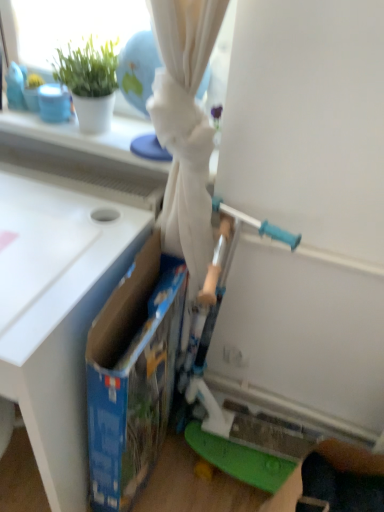
Question: Is white matte table at left to the left or to the right of blue cardboard box at center in the image?

Choices:
 (A) left
 (B) right

Answer: (A)

Question: Considering the positions of white matte table at left and blue cardboard box at center in the image, is white matte table at left wider or thinner than blue cardboard box at center?

Choices:
 (A) thin
 (B) wide

Answer: (B)

Question: Would you say white matte table at left is inside or outside blue cardboard box at center?

Choices:
 (A) inside
 (B) outside

Answer: (B)

Question: Considering their positions, is blue cardboard box at center located in front of or behind white matte table at left?

Choices:
 (A) front
 (B) behind

Answer: (B)

Question: Is point (140, 280) closer or farther from the camera than point (79, 233)?

Choices:
 (A) farther
 (B) closer

Answer: (A)

Question: Considering the positions of blue cardboard box at center and white matte table at left in the image, is blue cardboard box at center taller or shorter than white matte table at left?

Choices:
 (A) short
 (B) tall

Answer: (A)

Question: From the image's perspective, is blue cardboard box at center above or below white matte table at left?

Choices:
 (A) below
 (B) above

Answer: (A)